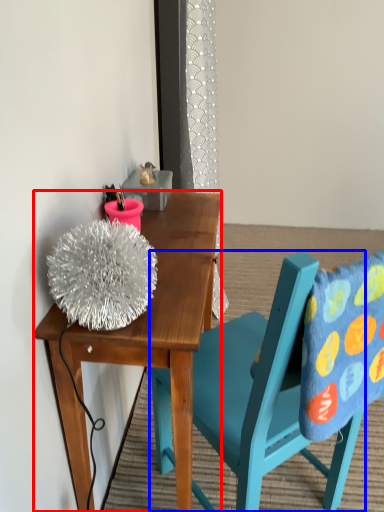
Question: Among these objects, which one is nearest to the camera, desk (highlighted by a red box) or chair (highlighted by a blue box)?

Choices:
 (A) desk
 (B) chair

Answer: (B)